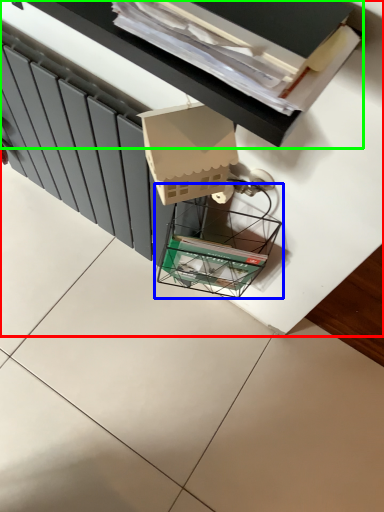
Question: Estimate the real-world distances between objects in this image. Which object is closer to furniture (highlighted by a red box), glass box (highlighted by a blue box) or vanity (highlighted by a green box)?

Choices:
 (A) glass box
 (B) vanity

Answer: (A)